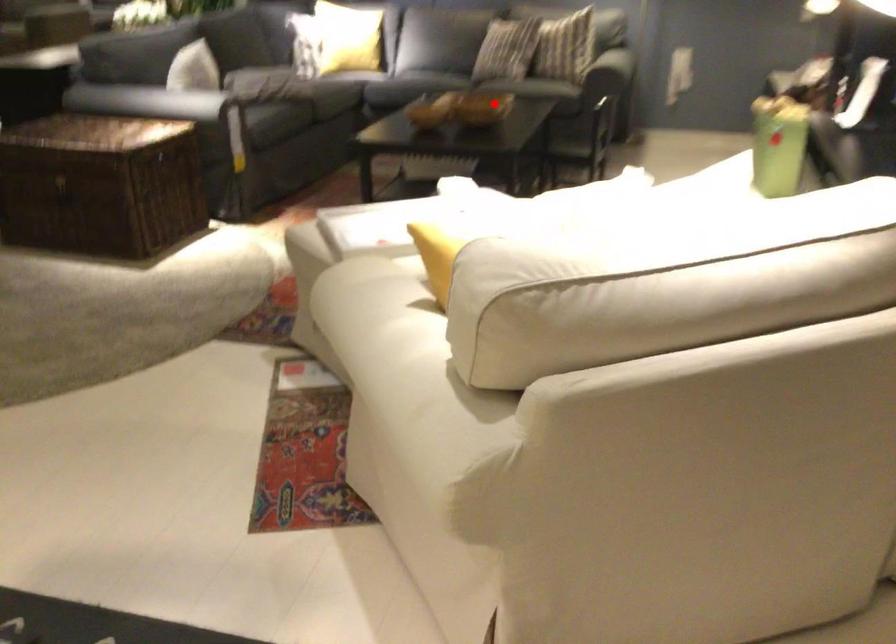
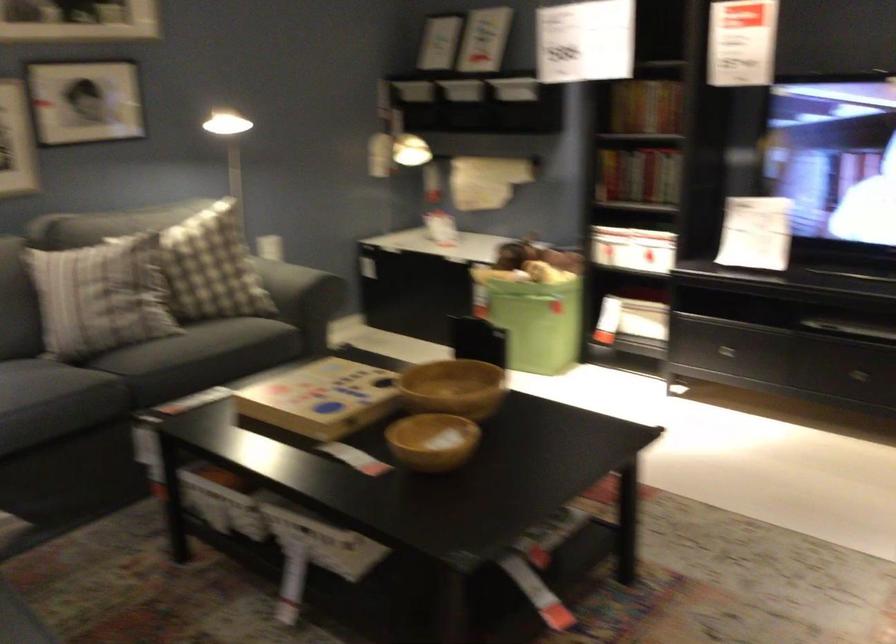
Where in the second image is the point corresponding to the highlighted location from the first image?

(453, 388)